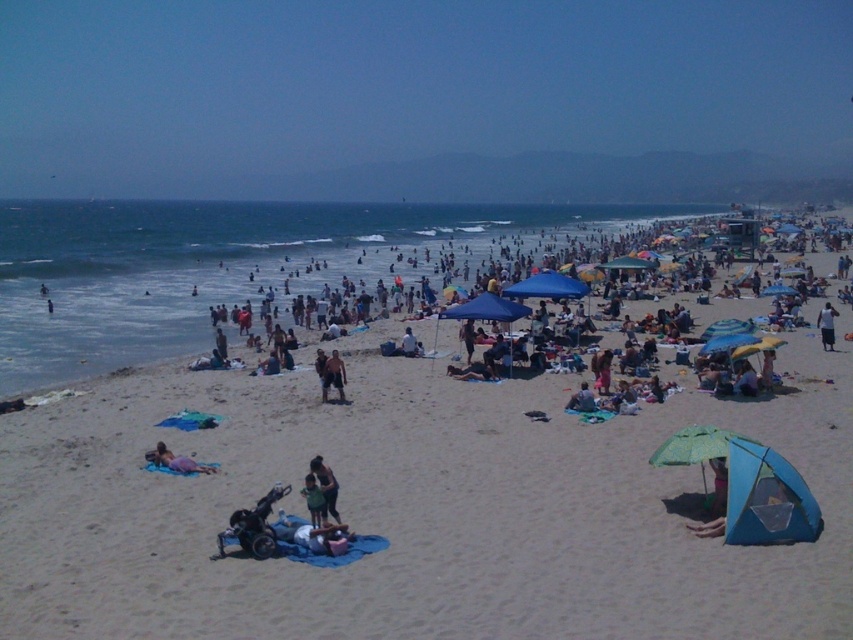
Who is higher up, dark green fabric dress at center or brown matte shorts at center?

brown matte shorts at center is higher up.

Does point (315, 458) come closer to viewer compared to point (339, 365)?

Yes.

Image resolution: width=853 pixels, height=640 pixels. What do you see at coordinates (326, 484) in the screenshot?
I see `dark green fabric dress at center` at bounding box center [326, 484].

Identify the location of dark green fabric dress at center. [x=326, y=484].

Can you confirm if brown matte shorts at center is taller than blue fabric tent at lower right?

Indeed, brown matte shorts at center has a greater height compared to blue fabric tent at lower right.

From the picture: Does brown matte shorts at center appear under blue fabric tent at lower right?

Incorrect, brown matte shorts at center is not positioned below blue fabric tent at lower right.

Between point (339, 380) and point (711, 460), which one is positioned in front?

Point (711, 460) is more forward.

Where is `brown matte shorts at center`? The image size is (853, 640). brown matte shorts at center is located at coordinates (334, 376).

Is blue fabric umbrella at center above dark green fabric dress at center?

Indeed, blue fabric umbrella at center is positioned over dark green fabric dress at center.

Who is higher up, blue fabric umbrella at center or dark green fabric dress at center?

blue fabric umbrella at center is above.

The height and width of the screenshot is (640, 853). I want to click on blue fabric umbrella at center, so click(547, 285).

The image size is (853, 640). I want to click on blue fabric umbrella at center, so click(547, 285).